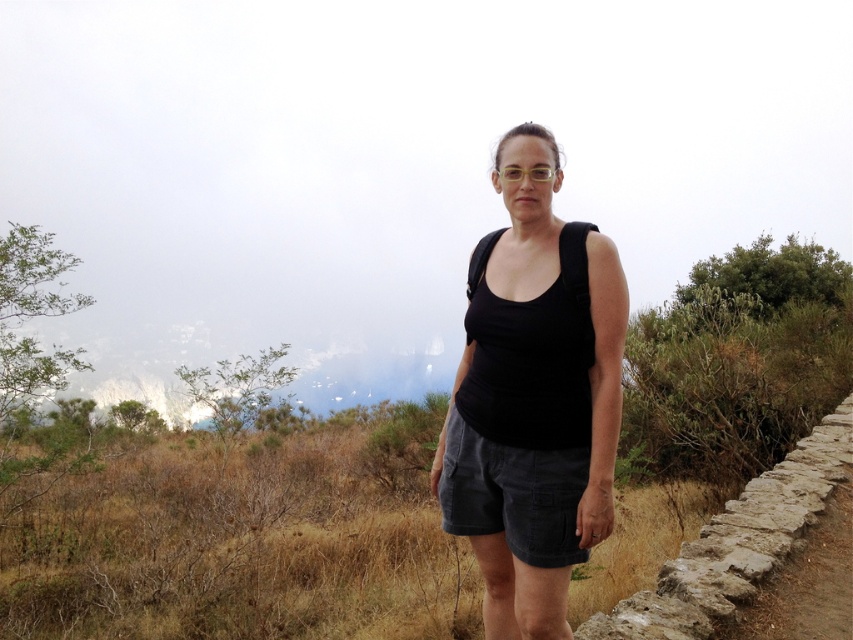
Question: Is black matte tank top at center thinner than dark gray corduroy shorts at center?

Choices:
 (A) yes
 (B) no

Answer: (B)

Question: Does brown dry grass at lower center appear under black matte tank top at center?

Choices:
 (A) yes
 (B) no

Answer: (A)

Question: Does brown dry grass at lower center appear under dark gray corduroy shorts at center?

Choices:
 (A) no
 (B) yes

Answer: (B)

Question: Which of the following is the closest to the observer?

Choices:
 (A) (602, 291)
 (B) (509, 332)
 (C) (496, 465)

Answer: (A)

Question: Which of the following is the closest to the observer?

Choices:
 (A) (567, 419)
 (B) (527, 403)

Answer: (A)

Question: Estimate the real-world distances between objects in this image. Which object is closer to the dark gray corduroy shorts at center?

Choices:
 (A) black fabric vest at center
 (B) brown dry grass at lower center
 (C) black matte tank top at center

Answer: (C)